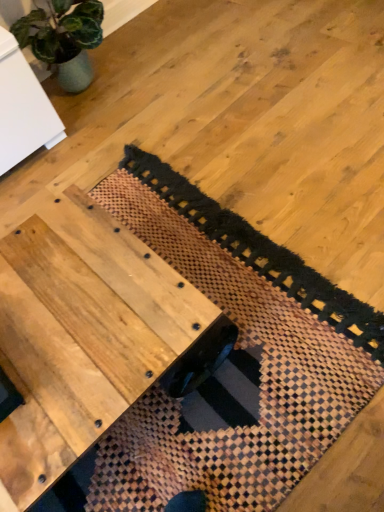
Identify the location of wooden woven mat at center. The image size is (384, 512). (238, 344).

This screenshot has height=512, width=384. Describe the element at coordinates (238, 344) in the screenshot. I see `wooden woven mat at center` at that location.

Locate an element on the screen. natural wood table at center is located at coordinates (83, 331).

The height and width of the screenshot is (512, 384). What do you see at coordinates (83, 331) in the screenshot?
I see `natural wood table at center` at bounding box center [83, 331].

What is the approximate height of natural wood table at center?

natural wood table at center is 13.29 inches in height.

The image size is (384, 512). In order to click on wooden woven mat at center in this screenshot , I will do `click(238, 344)`.

Would you say natural wood table at center is to the left or to the right of wooden woven mat at center in the picture?

natural wood table at center is to the left of wooden woven mat at center.

Relative to wooden woven mat at center, is natural wood table at center in front or behind?

In the image, natural wood table at center appears in front of wooden woven mat at center.

Which point is more distant from viewer, (155, 328) or (177, 197)?

The point (177, 197) is farther from the camera.

From the image's perspective, is natural wood table at center located beneath wooden woven mat at center?

Yes, from the image's perspective, natural wood table at center is beneath wooden woven mat at center.

From a real-world perspective, does natural wood table at center stand above wooden woven mat at center?

Yes, from a real-world perspective, natural wood table at center is above wooden woven mat at center.

Which of these two, natural wood table at center or wooden woven mat at center, is wider?

wooden woven mat at center.

Considering the sizes of objects natural wood table at center and wooden woven mat at center in the image provided, who is shorter, natural wood table at center or wooden woven mat at center?

wooden woven mat at center is shorter.

Between natural wood table at center and wooden woven mat at center, which one has larger size?

natural wood table at center is bigger.

Would you say natural wood table at center contains wooden woven mat at center?

That's incorrect, wooden woven mat at center is not inside natural wood table at center.

Are natural wood table at center and wooden woven mat at center far apart?

That's not correct — natural wood table at center is a little close to wooden woven mat at center.

Is natural wood table at center oriented away from wooden woven mat at center?

natural wood table at center is not turned away from wooden woven mat at center.

The height and width of the screenshot is (512, 384). I want to click on mat below the natural wood table at center (from a real-world perspective), so click(x=238, y=344).

In the scene shown: Can you confirm if wooden woven mat at center is positioned to the right of natural wood table at center?

Indeed, wooden woven mat at center is positioned on the right side of natural wood table at center.

Between wooden woven mat at center and natural wood table at center, which one is positioned in front?

Positioned in front is natural wood table at center.

Is point (382, 356) more distant than point (98, 391)?

Yes, it is.

From the image's perspective, who appears lower, wooden woven mat at center or natural wood table at center?

natural wood table at center, from the image's perspective.

From a real-world perspective, is wooden woven mat at center positioned above or below natural wood table at center?

Clearly, from a real-world perspective, wooden woven mat at center is below natural wood table at center.

Which object is wider, wooden woven mat at center or natural wood table at center?

With larger width is wooden woven mat at center.

Considering the relative sizes of wooden woven mat at center and natural wood table at center in the image provided, is wooden woven mat at center shorter than natural wood table at center?

Yes, wooden woven mat at center is shorter than natural wood table at center.

Considering the sizes of objects wooden woven mat at center and natural wood table at center in the image provided, who is smaller, wooden woven mat at center or natural wood table at center?

wooden woven mat at center is smaller.

Is wooden woven mat at center positioned beyond the bounds of natural wood table at center?

Yes, wooden woven mat at center is not within natural wood table at center.

Can you see wooden woven mat at center touching natural wood table at center?

There is a gap between wooden woven mat at center and natural wood table at center.

Based on the photo, is wooden woven mat at center facing away from natural wood table at center?

A: Yes, natural wood table at center is at the back of wooden woven mat at center.

How far apart are wooden woven mat at center and natural wood table at center?

wooden woven mat at center is 14.30 inches from natural wood table at center.

At what (x,y) coordinates should I click in order to perform the action: click on table on the left of wooden woven mat at center. Please return your answer as a coordinate pair (x, y). The image size is (384, 512). Looking at the image, I should click on (83, 331).

The image size is (384, 512). In the image, there is a natural wood table at center. What are the coordinates of `mat above it (from the image's perspective)` in the screenshot? It's located at (238, 344).

In the image, there is a wooden woven mat at center. Where is `table below it (from the image's perspective)`? table below it (from the image's perspective) is located at coordinates (83, 331).